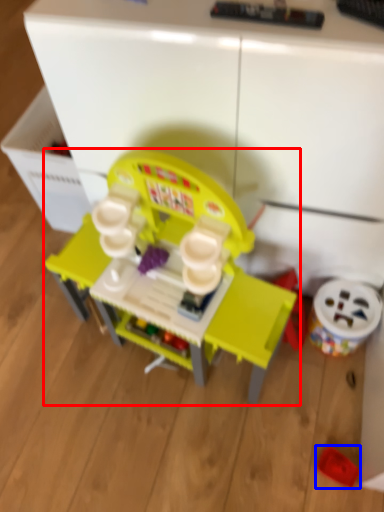
Question: Which point is further to the camera, toy (highlighted by a red box) or toy (highlighted by a blue box)?

Choices:
 (A) toy
 (B) toy

Answer: (B)